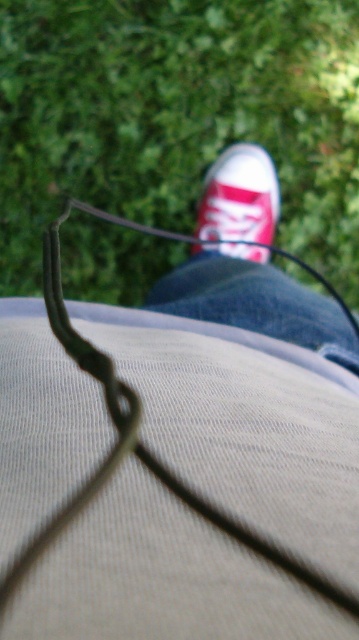
You are standing in a park and see the green grass at upper center and the matte canvas shoe at center. Which object is closer to your viewpoint?

The green grass at upper center is closer to your viewpoint because the matte canvas shoe at center is behind it.